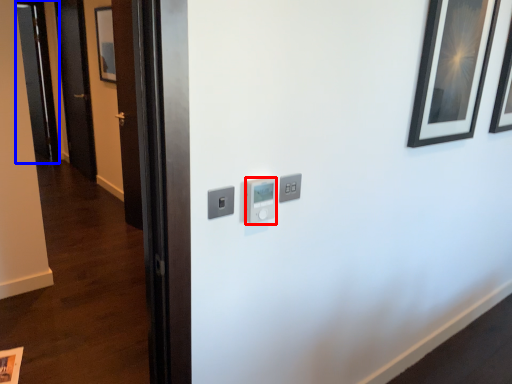
Question: Which object appears closest to the camera in this image, light switch (highlighted by a red box) or glass door (highlighted by a blue box)?

Choices:
 (A) light switch
 (B) glass door

Answer: (A)